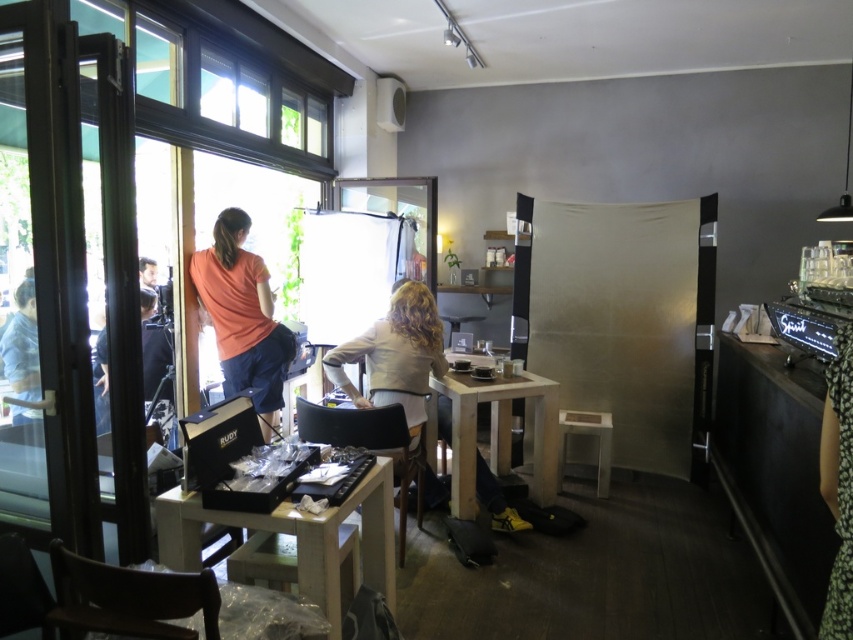
Question: Among these objects, which one is farthest from the camera?

Choices:
 (A) white plastic stool at lower right
 (B) light wood table at center
 (C) orange matte shirt at left
 (D) wooden table at center

Answer: (A)

Question: Is wooden table at center to the right of white matte blouse at center from the viewer's perspective?

Choices:
 (A) yes
 (B) no

Answer: (B)

Question: Observing the image, what is the correct spatial positioning of light wood table at center in reference to white matte blouse at center?

Choices:
 (A) above
 (B) below

Answer: (B)

Question: Is orange matte shirt at left smaller than white plastic stool at lower right?

Choices:
 (A) yes
 (B) no

Answer: (B)

Question: Which object appears closest to the camera in this image?

Choices:
 (A) wooden table at center
 (B) orange matte shirt at left
 (C) light wood table at center

Answer: (A)

Question: Which of these objects is positioned closest to the light wood table at center?

Choices:
 (A) white matte blouse at center
 (B) white plastic stool at lower right
 (C) wooden table at center
 (D) orange matte shirt at left

Answer: (B)